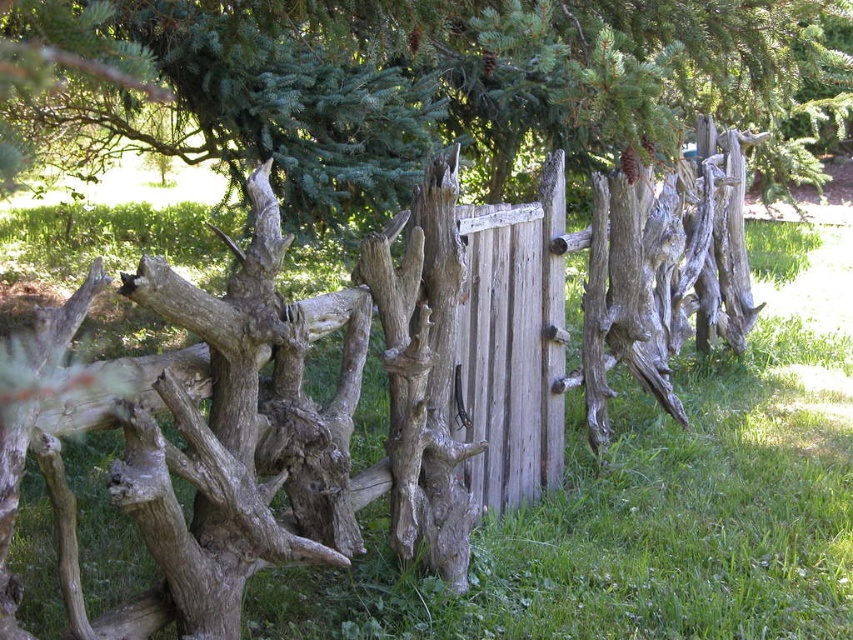
You are standing in front of the rustic wooden fence and want to determine the relative positions of two points on the fence. Which point is closer to you, point (316, 464) or point (376, 182)?

Point (316, 464) is closer to the camera than point (376, 182), so it is closer to you.